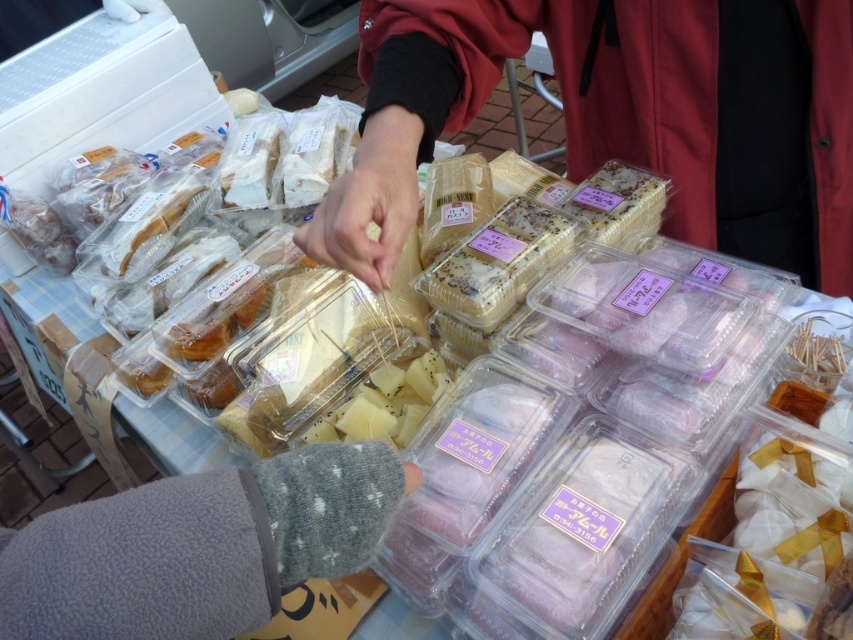
You are a customer at the food market and you want to find the smooth red jacket at center. Where would you look on the table?

The smooth red jacket at center is located at the 2D coordinates point (x=624, y=116) on the table.

Based on the photo, you are a customer at the market and want to pick up both the smooth red jacket at center and the gray fleece glove at lower left. Which item is closer to your hand when you reach out from the front of the table?

The smooth red jacket at center is closer to your hand because the gray fleece glove at lower left is behind it, meaning the red jacket is in front and more accessible.